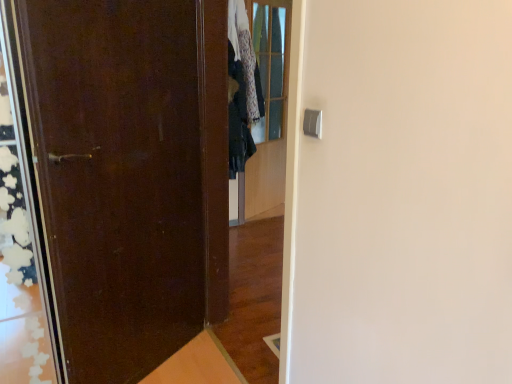
Question: Is clear glass door at upper center behind dark green fabric at center?

Choices:
 (A) no
 (B) yes

Answer: (B)

Question: Is clear glass door at upper center bigger than dark green fabric at center?

Choices:
 (A) yes
 (B) no

Answer: (A)

Question: From the image's perspective, would you say clear glass door at upper center is positioned over dark green fabric at center?

Choices:
 (A) yes
 (B) no

Answer: (B)

Question: Considering the relative sizes of clear glass door at upper center and dark green fabric at center in the image provided, is clear glass door at upper center smaller than dark green fabric at center?

Choices:
 (A) yes
 (B) no

Answer: (B)

Question: Can you confirm if clear glass door at upper center is positioned to the right of dark green fabric at center?

Choices:
 (A) no
 (B) yes

Answer: (B)

Question: Can you confirm if clear glass door at upper center is thinner than dark green fabric at center?

Choices:
 (A) yes
 (B) no

Answer: (A)

Question: Does dark green fabric at center have a larger size compared to matte dark brown door at left?

Choices:
 (A) yes
 (B) no

Answer: (B)

Question: Can you confirm if dark green fabric at center is wider than matte dark brown door at left?

Choices:
 (A) yes
 (B) no

Answer: (A)

Question: From the image's perspective, is dark green fabric at center located above matte dark brown door at left?

Choices:
 (A) yes
 (B) no

Answer: (A)

Question: Is dark green fabric at center positioned before matte dark brown door at left?

Choices:
 (A) no
 (B) yes

Answer: (A)

Question: Does dark green fabric at center have a smaller size compared to matte dark brown door at left?

Choices:
 (A) no
 (B) yes

Answer: (B)

Question: Are dark green fabric at center and matte dark brown door at left beside each other?

Choices:
 (A) yes
 (B) no

Answer: (B)

Question: Can you confirm if matte dark brown door at left is shorter than dark green fabric at center?

Choices:
 (A) yes
 (B) no

Answer: (B)